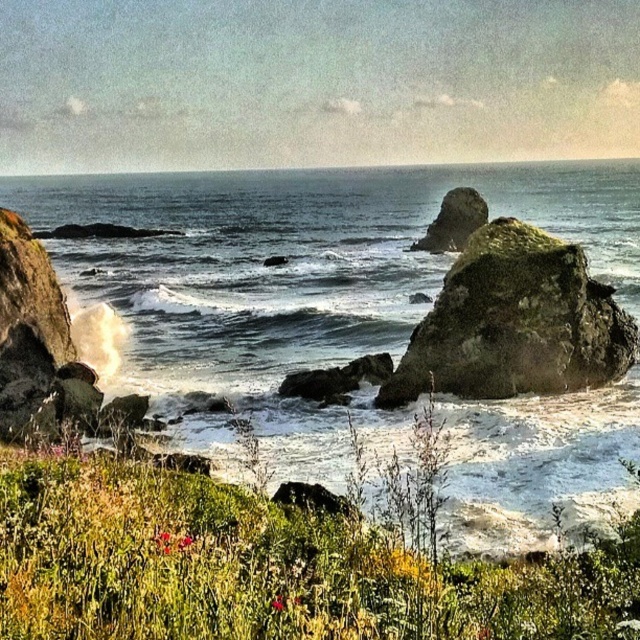
Question: Can you confirm if clear blue water at center is smaller than rough textured rock at center?

Choices:
 (A) yes
 (B) no

Answer: (B)

Question: Which object is the farthest from the clear blue water at center?

Choices:
 (A) rough textured rock at center
 (B) green mossy rock at center-right

Answer: (B)

Question: Does clear blue water at center appear under rough textured rock at center?

Choices:
 (A) yes
 (B) no

Answer: (B)

Question: Is clear blue water at center below green mossy rock at center-right?

Choices:
 (A) yes
 (B) no

Answer: (B)

Question: Which of the following is the closest to the observer?

Choices:
 (A) green mossy rock at center-right
 (B) rough textured rock at center

Answer: (A)

Question: Which point is farther to the camera?

Choices:
 (A) green mossy rock at center-right
 (B) rough textured rock at center
 (C) clear blue water at center

Answer: (B)